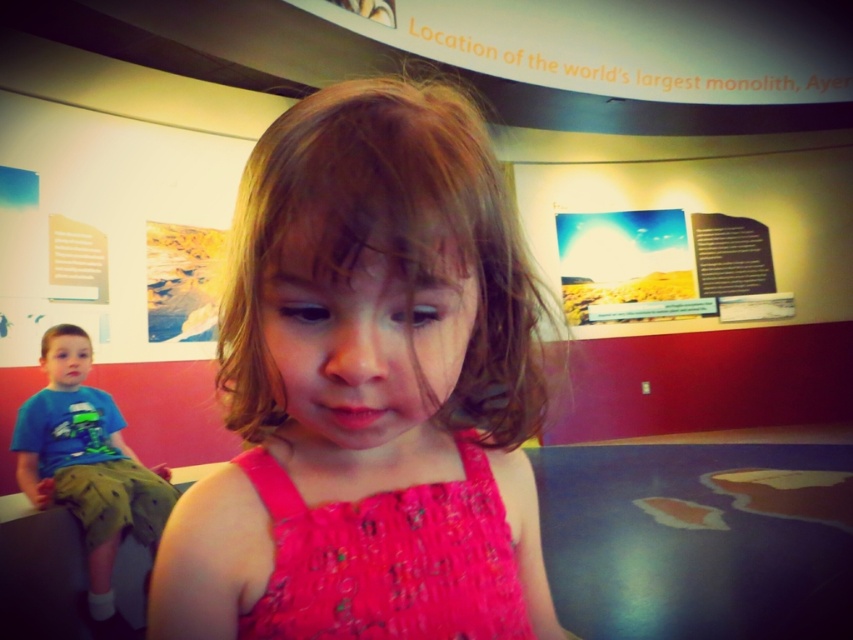
Can you confirm if blue-green t-shirt at left is positioned to the left of brown matte hair at left?

In fact, blue-green t-shirt at left is to the right of brown matte hair at left.

Looking at this image, measure the distance from blue-green t-shirt at left to brown matte hair at left.

blue-green t-shirt at left and brown matte hair at left are 18.95 inches apart.

This screenshot has height=640, width=853. What do you see at coordinates (90, 483) in the screenshot? I see `blue-green t-shirt at left` at bounding box center [90, 483].

Locate an element on the screen. blue-green t-shirt at left is located at coordinates (90, 483).

Does point (431, 618) come closer to viewer compared to point (51, 378)?

Yes.

Is pink lace dress at center to the right of smooth skin face at left from the viewer's perspective?

Indeed, pink lace dress at center is positioned on the right side of smooth skin face at left.

Which is behind, point (367, 547) or point (64, 385)?

Positioned behind is point (64, 385).

I want to click on pink lace dress at center, so click(387, 560).

Can you confirm if smooth skin face at left is smaller than brown matte hair at left?

No, smooth skin face at left is not smaller than brown matte hair at left.

Find the location of a particular element. The image size is (853, 640). smooth skin face at left is located at coordinates (67, 360).